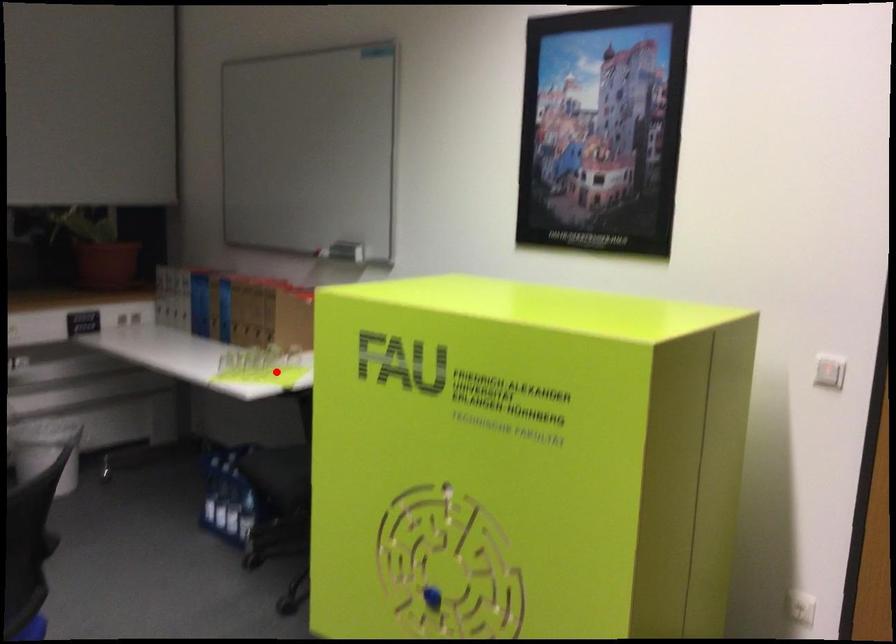
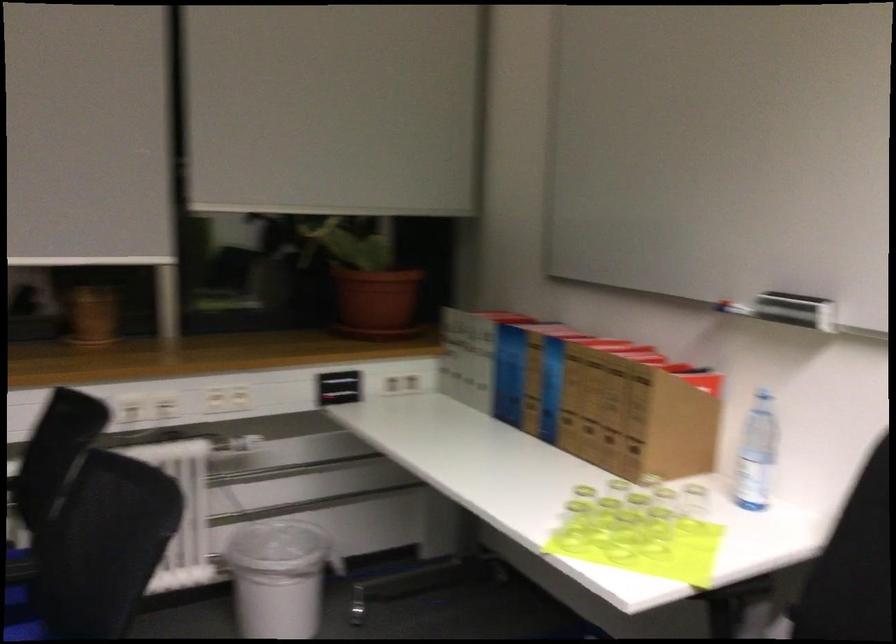
Question: I am providing you with two images of the same scene from different viewpoints. Given a red point in image1, look at the same physical point in image2. Is it:

Choices:
 (A) Closer to the viewpoint
 (B) Farther from the viewpoint

Answer: (A)